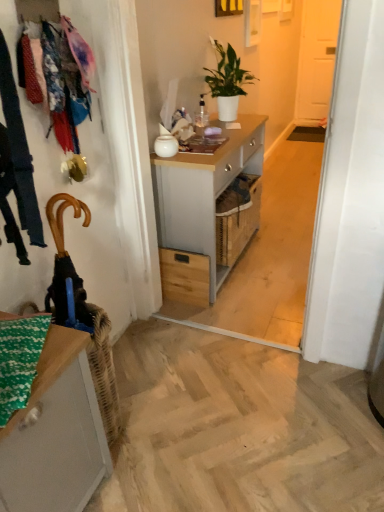
Question: Relative to white glossy vase at center, is matte gray cabinet at lower left in front or behind?

Choices:
 (A) behind
 (B) front

Answer: (B)

Question: From a real-world perspective, relative to white glossy vase at center, is matte gray cabinet at lower left vertically above or below?

Choices:
 (A) below
 (B) above

Answer: (A)

Question: Based on their relative distances, which object is farther from the white matte door at upper right?

Choices:
 (A) floral fabric clothesline at left
 (B) wooden drawer at center
 (C) light gray wood desk at center
 (D) white glossy vase at center
 (E) matte gray cabinet at lower left

Answer: (E)

Question: Based on their relative distances, which object is nearer to the velvet blue coat at left?

Choices:
 (A) white matte door at upper right
 (B) white matte plant at center
 (C) floral fabric clothesline at left
 (D) matte gray cabinet at lower left
 (E) wooden drawer at center

Answer: (C)